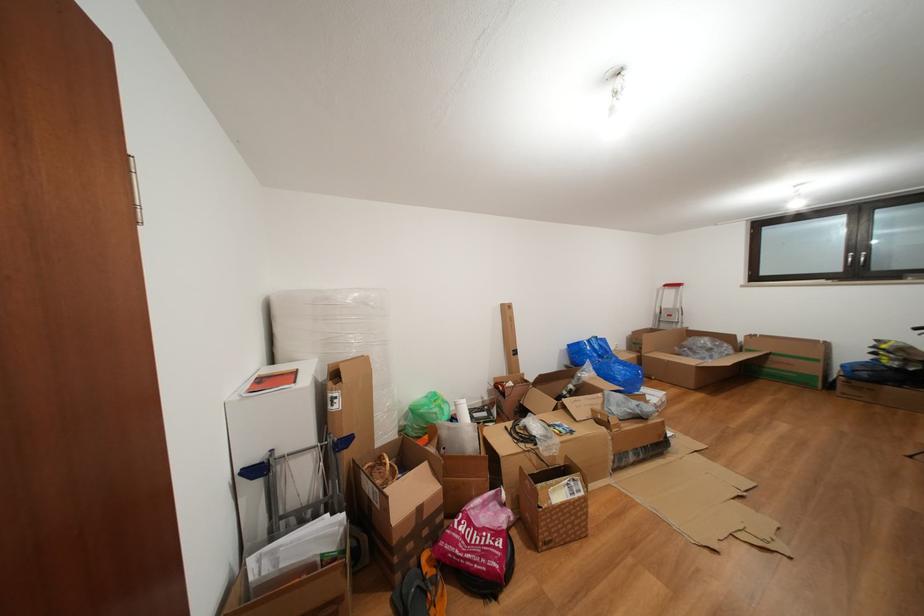
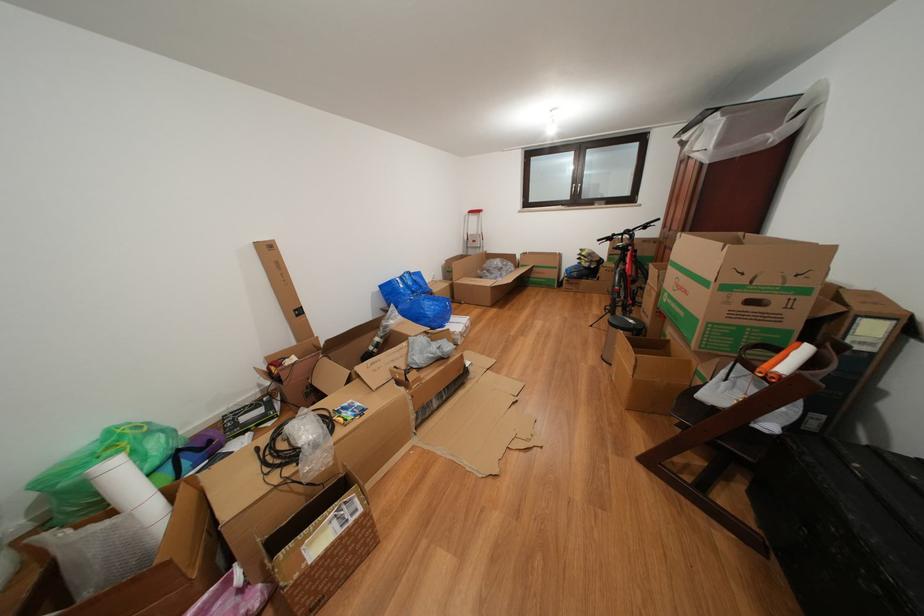
The images are taken continuously from a first-person perspective. In which direction is your viewpoint rotating?

The rotation direction of the camera is right-down.